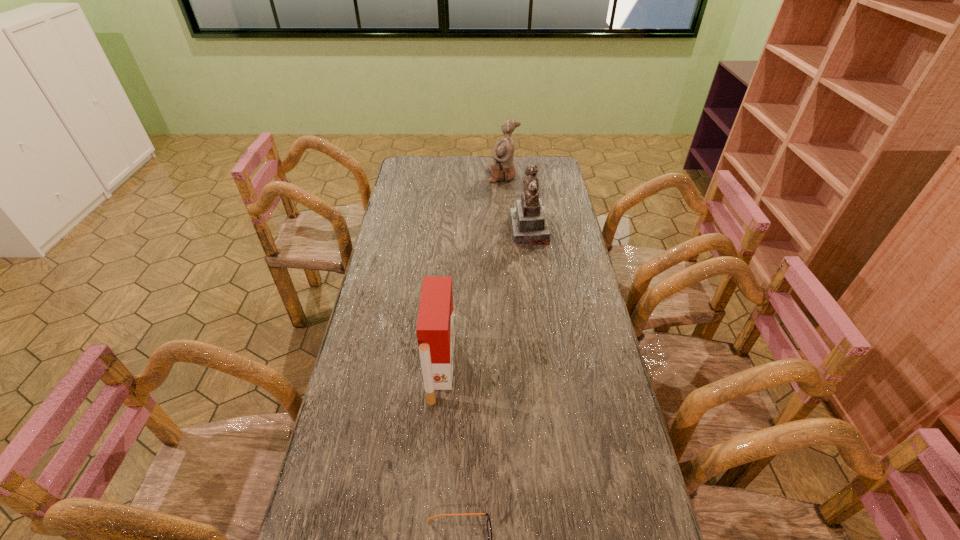
At what (x,y) coordinates should I click in order to perform the action: click on object present at the far edge. Please return your answer as a coordinate pair (x, y). Looking at the image, I should click on (502, 169).

Identify the location of object that is positioned at the right edge. This screenshot has width=960, height=540. (529, 223).

In the image, there is a desktop. Where is `vacant space at the far edge`? This screenshot has width=960, height=540. vacant space at the far edge is located at coordinates (476, 177).

Find the location of a particular element. This screenshot has height=540, width=960. free spot at the left edge of the desktop is located at coordinates (369, 326).

In the image, there is a desktop. What are the coordinates of `free region at the right edge` in the screenshot? It's located at (557, 183).

Find the location of `free area in between the third farthest object and the second farthest object`. free area in between the third farthest object and the second farthest object is located at coordinates (485, 299).

Locate an element on the screen. This screenshot has width=960, height=540. free space between the third farthest object and the nearer figurine is located at coordinates point(485,299).

Locate an element on the screen. the second closest object relative to the farthest object is located at coordinates pos(435,329).

Find the location of a particular element. The image size is (960, 540). object identified as the third closest to the cigarette case is located at coordinates (502, 169).